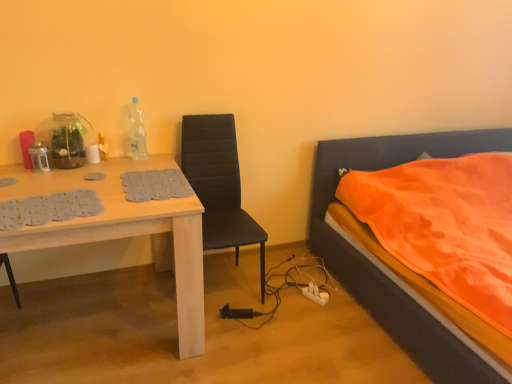
Question: From a real-world perspective, is transparent plastic bottle at upper center below black leather chair at center?

Choices:
 (A) no
 (B) yes

Answer: (A)

Question: From a real-world perspective, is transparent plastic bottle at upper center on black leather chair at center?

Choices:
 (A) no
 (B) yes

Answer: (B)

Question: From the image's perspective, would you say transparent plastic bottle at upper center is positioned over black leather chair at center?

Choices:
 (A) yes
 (B) no

Answer: (A)

Question: From the image's perspective, is transparent plastic bottle at upper center located beneath black leather chair at center?

Choices:
 (A) no
 (B) yes

Answer: (A)

Question: Can you confirm if transparent plastic bottle at upper center is bigger than black leather chair at center?

Choices:
 (A) no
 (B) yes

Answer: (A)

Question: Is transparent plastic bottle at upper center to the right of black leather chair at center from the viewer's perspective?

Choices:
 (A) no
 (B) yes

Answer: (A)

Question: Is orange fabric bed at right shorter than transparent plastic bottle at upper center?

Choices:
 (A) no
 (B) yes

Answer: (A)

Question: Does orange fabric bed at right appear on the right side of transparent plastic bottle at upper center?

Choices:
 (A) no
 (B) yes

Answer: (B)

Question: Can we say orange fabric bed at right lies outside transparent plastic bottle at upper center?

Choices:
 (A) no
 (B) yes

Answer: (B)

Question: Is there a large distance between orange fabric bed at right and transparent plastic bottle at upper center?

Choices:
 (A) yes
 (B) no

Answer: (A)

Question: Is transparent plastic bottle at upper center located within orange fabric bed at right?

Choices:
 (A) yes
 (B) no

Answer: (B)

Question: Can you confirm if orange fabric bed at right is wider than transparent plastic bottle at upper center?

Choices:
 (A) yes
 (B) no

Answer: (A)

Question: From a real-world perspective, is white plastic power outlet at lower center positioned under orange fabric bed at right based on gravity?

Choices:
 (A) no
 (B) yes

Answer: (B)